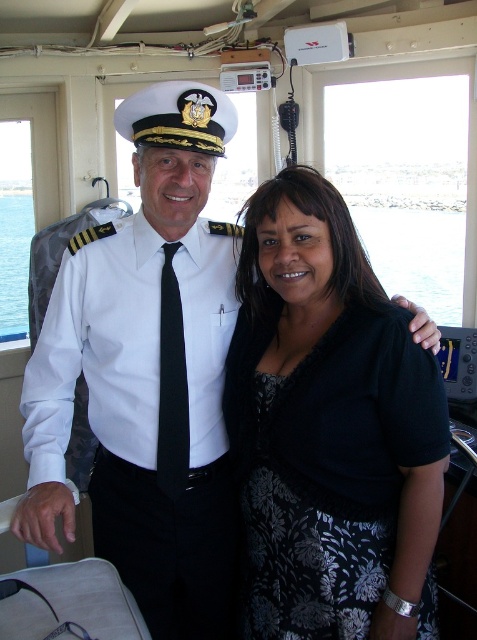
Can you confirm if black floral dress at center is wider than white cotton shirt at center?

In fact, black floral dress at center might be narrower than white cotton shirt at center.

Between black floral dress at center and white cotton shirt at center, which one has less height?

white cotton shirt at center

Which is behind, point (375, 400) or point (158, 541)?

The point (158, 541) is behind.

Locate an element on the screen. black floral dress at center is located at coordinates (330, 429).

Does black floral dress at center have a larger size compared to blue water at center?

Yes, black floral dress at center is bigger than blue water at center.

Between point (241, 396) and point (230, 212), which one is positioned in front?

Point (241, 396) is in front.

Where is `black floral dress at center`? The image size is (477, 640). black floral dress at center is located at coordinates (330, 429).

Between white cotton shirt at center and blue water at center, which one appears on the right side from the viewer's perspective?

From the viewer's perspective, blue water at center appears more on the right side.

This screenshot has width=477, height=640. What do you see at coordinates (146, 410) in the screenshot?
I see `white cotton shirt at center` at bounding box center [146, 410].

I want to click on white cotton shirt at center, so (146, 410).